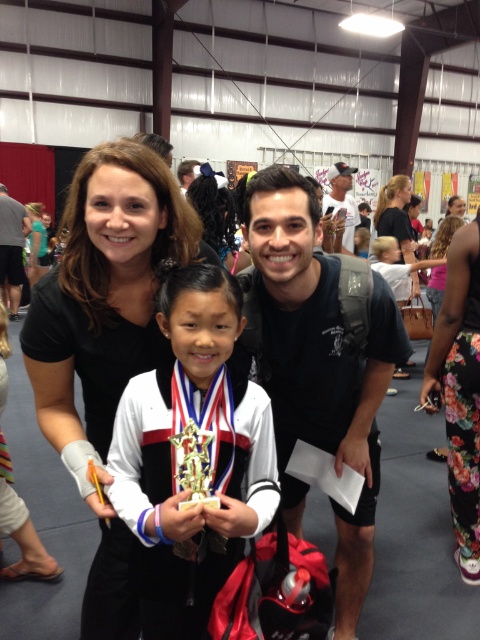
You are a photographer standing at the front of the gymnasium. You want to take a photo of the gold metallic trophy at center so that it appears larger in the photo. Which direction should you move relative to the trophy?

To make the gold metallic trophy at center appear larger in the photo, you should move closer to it. Since the trophy is currently 34.75 inches from the camera, moving closer will reduce the distance and increase its size in the frame.

You are standing in the gymnasium and want to take a photo of the two points mentioned. Which point, point (233, 211) or point (429, 292), will appear larger in your photo?

Point (233, 211) will appear larger in the photo because it is closer to the camera than point (429, 292).